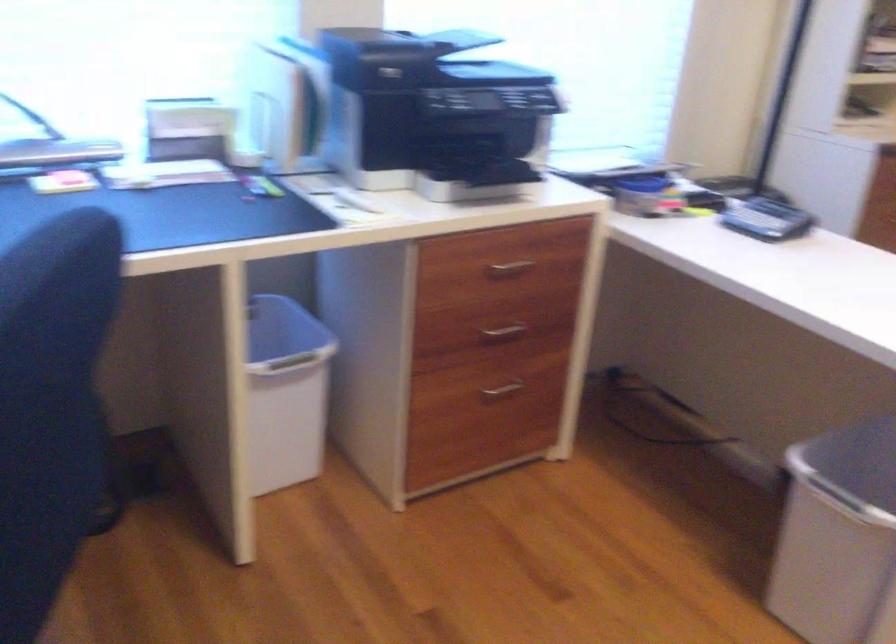
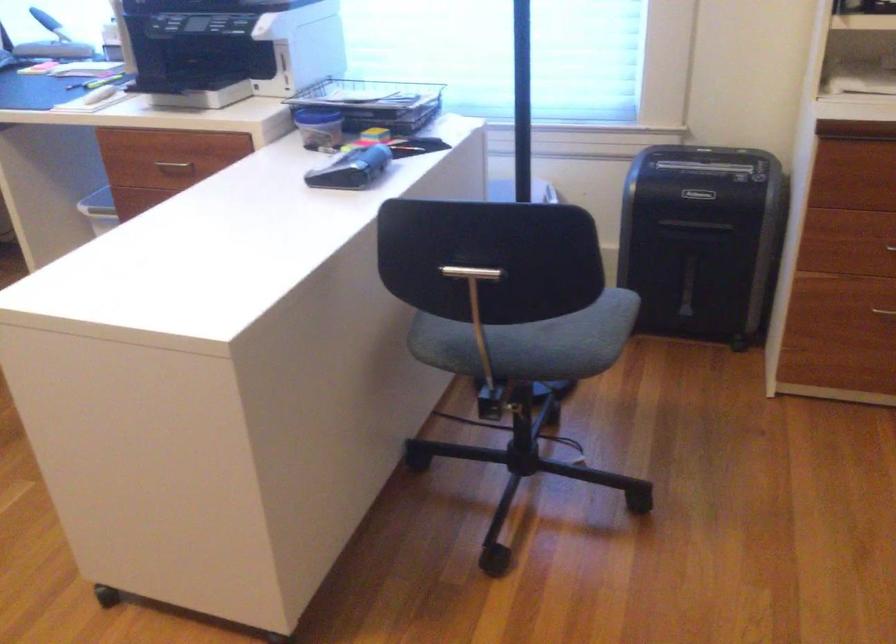
Question: I am providing you with two images of the same scene from different viewpoints. Which of the following objects are not visible in image2?

Choices:
 (A) orange and black bag
 (B) blue trash can rim
 (C) wire paper tray
 (D) shredder bin handle

Answer: (B)